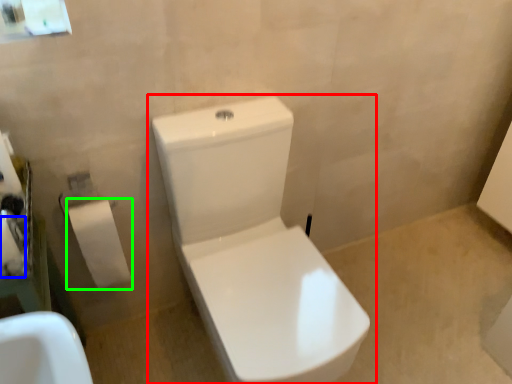
Question: Considering the real-world distances, which object is closest to toilet (highlighted by a red box)? toilet paper (highlighted by a blue box) or toiletry (highlighted by a green box).

Choices:
 (A) toilet paper
 (B) toiletry

Answer: (B)